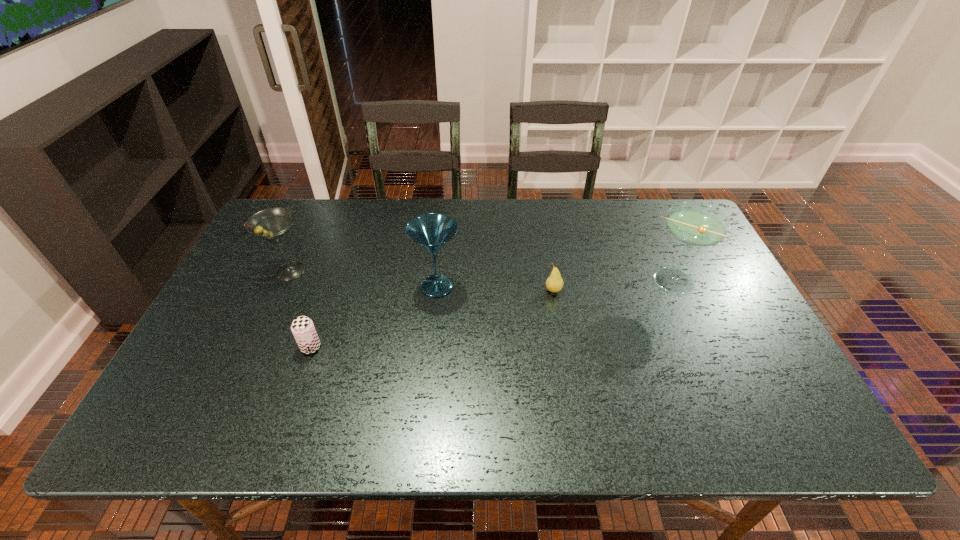
Find the location of a particular element. This screenshot has height=540, width=960. the rightmost object is located at coordinates (695, 224).

Where is `the leftmost object`? the leftmost object is located at coordinates (273, 224).

Identify the location of the third object from left to right. The width and height of the screenshot is (960, 540). (432, 231).

At what (x,y) coordinates should I click in order to perform the action: click on the fourth object from left to right. Please return your answer as a coordinate pair (x, y). This screenshot has width=960, height=540. Looking at the image, I should click on (554, 283).

Where is `the second object from left to right`? the second object from left to right is located at coordinates (302, 327).

The image size is (960, 540). I want to click on beer can, so click(x=302, y=327).

The width and height of the screenshot is (960, 540). I want to click on free space located 0.110m on the front of the rightmost martini, so click(692, 333).

Image resolution: width=960 pixels, height=540 pixels. Find the location of `vacant region located on the back of the leftmost object`. vacant region located on the back of the leftmost object is located at coordinates (322, 203).

Locate an element on the screen. The image size is (960, 540). vacant space situated 0.070m on the left of the third object from left to right is located at coordinates (388, 286).

I want to click on vacant space situated on the right of the pear, so click(700, 291).